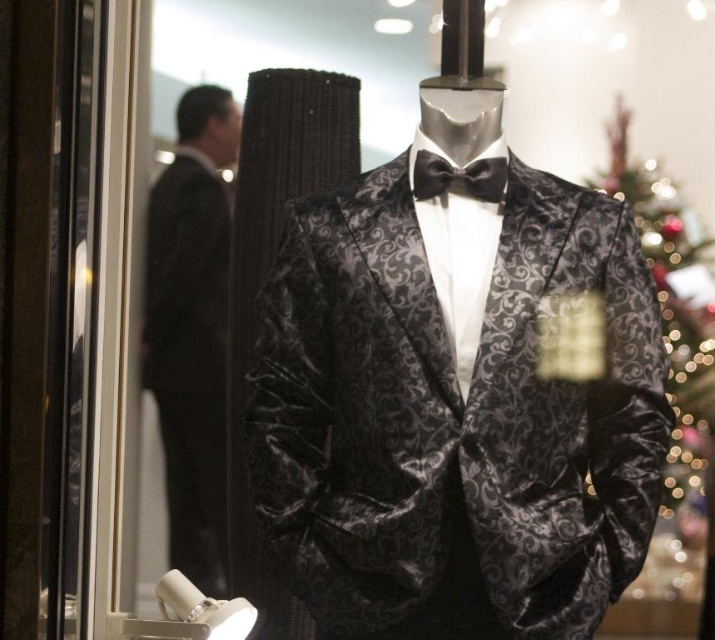
Question: Among these points, which one is farthest from the camera?

Choices:
 (A) (498, 476)
 (B) (498, 163)
 (C) (225, 291)

Answer: (C)

Question: Where is velvet/black suit at center located in relation to black velvet suit at left in the image?

Choices:
 (A) right
 (B) left

Answer: (A)

Question: Estimate the real-world distances between objects in this image. Which object is farther from the black velvet suit at left?

Choices:
 (A) black satin bow tie at center
 (B) velvet/black suit at center

Answer: (A)

Question: Is black velvet suit at left wider than black satin bow tie at center?

Choices:
 (A) no
 (B) yes

Answer: (B)

Question: Does velvet/black suit at center appear on the right side of black satin bow tie at center?

Choices:
 (A) yes
 (B) no

Answer: (B)

Question: Based on their relative distances, which object is farther from the black velvet suit at left?

Choices:
 (A) black satin bow tie at center
 (B) velvet/black suit at center

Answer: (A)